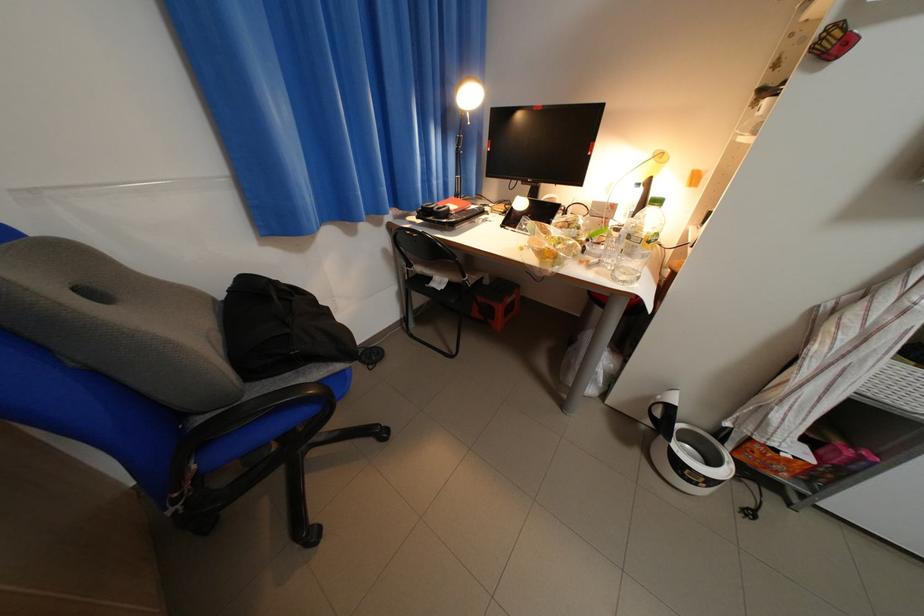
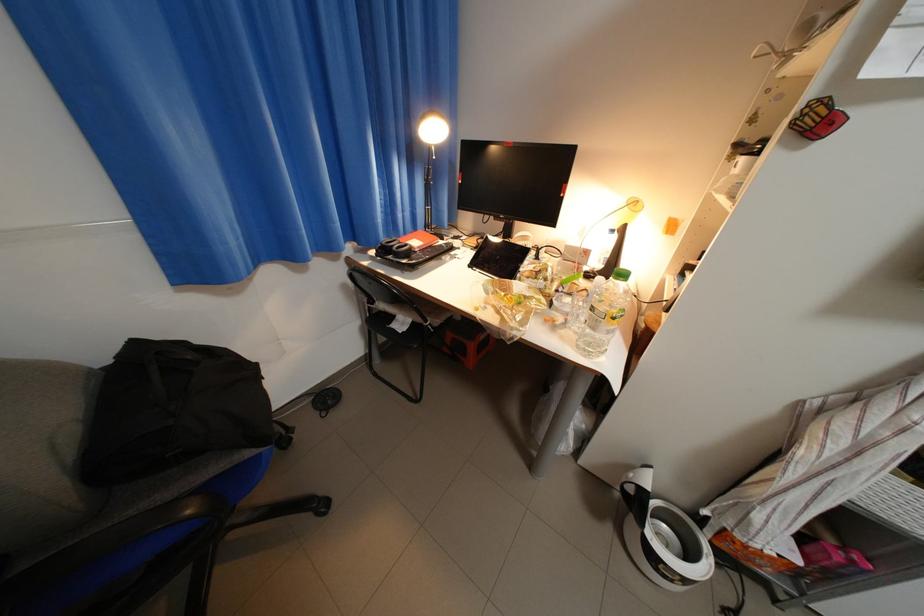
In the second image, find the point that corresponds to pixel 396 252 in the first image.

(355, 286)